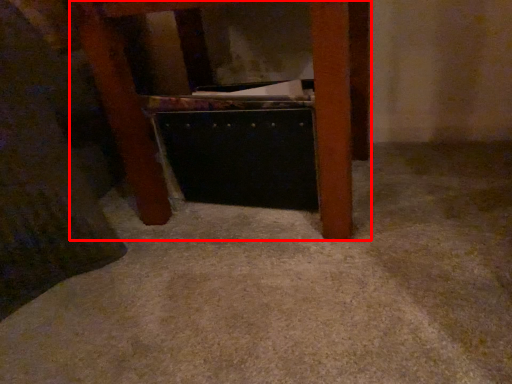
Question: In this image, where is furniture (annotated by the red box) located relative to drawer?

Choices:
 (A) right
 (B) left

Answer: (B)